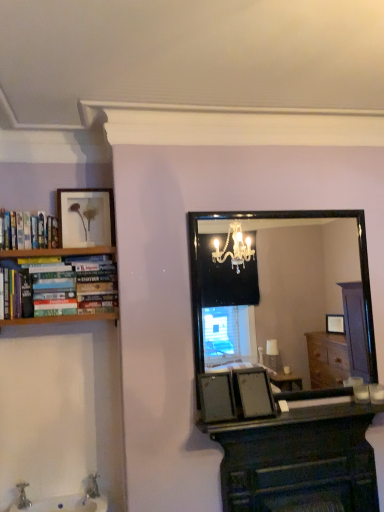
Question: From the image's perspective, is matte gold picture frame at upper left on white glossy sink at lower left?

Choices:
 (A) no
 (B) yes

Answer: (B)

Question: Does matte gold picture frame at upper left have a lesser height compared to white glossy sink at lower left?

Choices:
 (A) no
 (B) yes

Answer: (A)

Question: Are matte gold picture frame at upper left and white glossy sink at lower left making contact?

Choices:
 (A) yes
 (B) no

Answer: (B)

Question: Does matte gold picture frame at upper left have a greater width compared to white glossy sink at lower left?

Choices:
 (A) no
 (B) yes

Answer: (A)

Question: Is matte gold picture frame at upper left thinner than white glossy sink at lower left?

Choices:
 (A) no
 (B) yes

Answer: (B)

Question: Is dark wood computer desk at center taller or shorter than white glossy sink at lower left?

Choices:
 (A) tall
 (B) short

Answer: (A)

Question: From the image's perspective, relative to white glossy sink at lower left, is dark wood computer desk at center above or below?

Choices:
 (A) below
 (B) above

Answer: (B)

Question: Is dark wood computer desk at center to the left or to the right of white glossy sink at lower left in the image?

Choices:
 (A) left
 (B) right

Answer: (B)

Question: Looking at their shapes, would you say dark wood computer desk at center is wider or thinner than white glossy sink at lower left?

Choices:
 (A) thin
 (B) wide

Answer: (A)

Question: Looking at their shapes, would you say black glass mirror at center is wider or thinner than smooth black countertop at lower center?

Choices:
 (A) thin
 (B) wide

Answer: (A)

Question: Visually, is black glass mirror at center positioned to the left or to the right of smooth black countertop at lower center?

Choices:
 (A) right
 (B) left

Answer: (B)

Question: Is black glass mirror at center taller or shorter than smooth black countertop at lower center?

Choices:
 (A) short
 (B) tall

Answer: (B)

Question: Based on their sizes in the image, would you say black glass mirror at center is bigger or smaller than smooth black countertop at lower center?

Choices:
 (A) small
 (B) big

Answer: (B)

Question: In terms of size, does white glossy sink at lower left appear bigger or smaller than matte gold picture frame at upper left?

Choices:
 (A) big
 (B) small

Answer: (A)

Question: Considering the positions of point (89, 506) and point (96, 219), is point (89, 506) closer or farther from the camera than point (96, 219)?

Choices:
 (A) farther
 (B) closer

Answer: (B)